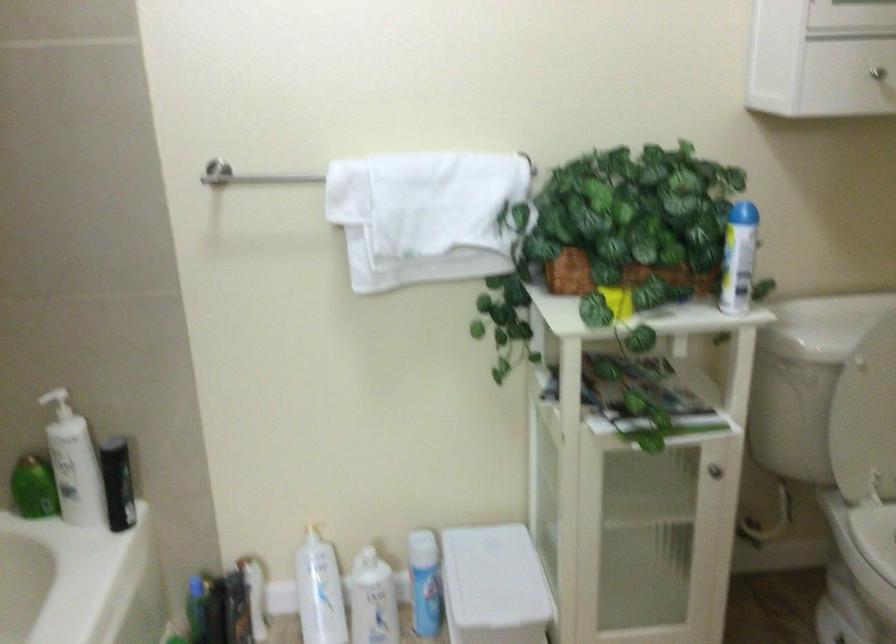
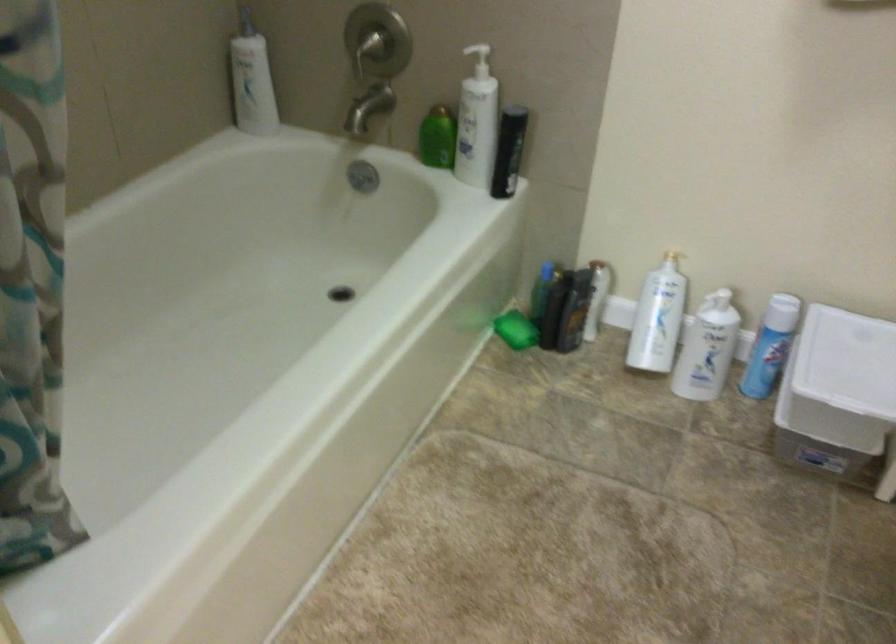
Where in the second image is the point corresponding to point 368,561 from the first image?

(719, 301)